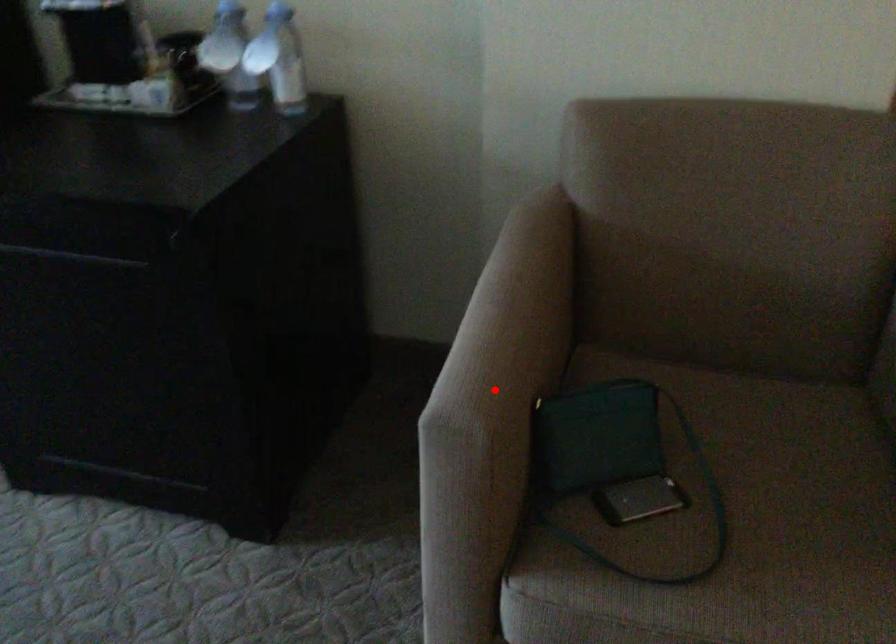
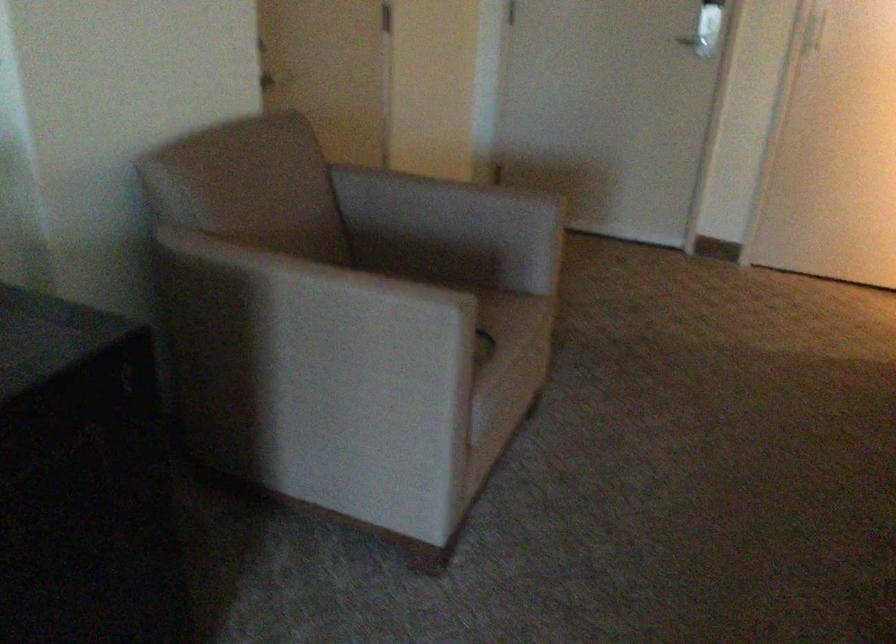
Where in the second image is the point corresponding to the highlighted location from the first image?

(435, 289)